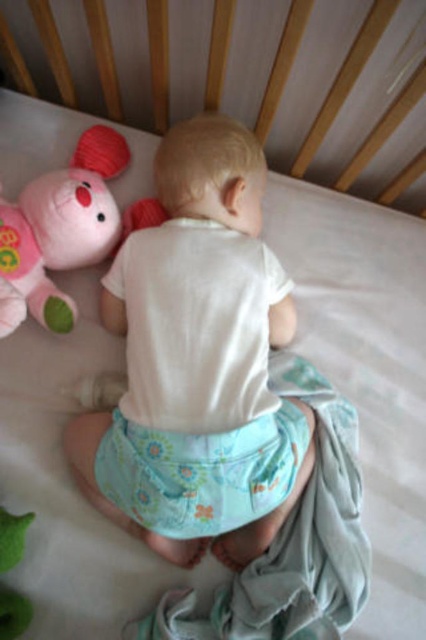
Which of these two, floral fabric diaper at center or plush pink bear at left, stands shorter?

floral fabric diaper at center

Is floral fabric diaper at center thinner than plush pink bear at left?

No.

Between point (120, 493) and point (2, 241), which one is positioned behind?

Point (2, 241)

Locate an element on the screen. The width and height of the screenshot is (426, 640). floral fabric diaper at center is located at coordinates (201, 472).

Who is higher up, plush pink bear at left or green fabric toy at lower left?

plush pink bear at left is above.

Is the position of plush pink bear at left more distant than that of green fabric toy at lower left?

Yes, it is.

What do you see at coordinates (65, 228) in the screenshot? I see `plush pink bear at left` at bounding box center [65, 228].

This screenshot has height=640, width=426. What are the coordinates of `plush pink bear at left` in the screenshot? It's located at (65, 228).

In the scene shown: Between white cotton baby at center and floral fabric diaper at center, which one is positioned lower?

Positioned lower is floral fabric diaper at center.

Can you confirm if white cotton baby at center is taller than floral fabric diaper at center?

Indeed, white cotton baby at center has a greater height compared to floral fabric diaper at center.

Locate an element on the screen. white cotton baby at center is located at coordinates (198, 364).